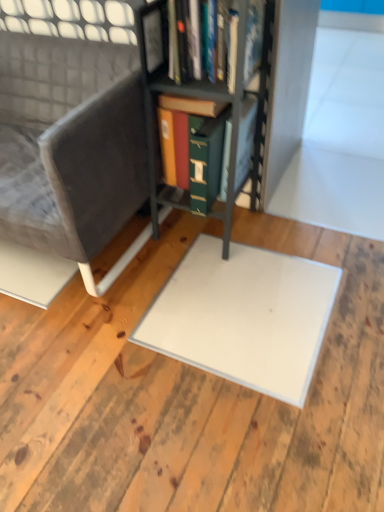
Question: Is metallic gray bookcase at center a part of white matte plywood at center?

Choices:
 (A) yes
 (B) no

Answer: (B)

Question: Is white matte plywood at center at the left side of metallic gray bookcase at center?

Choices:
 (A) no
 (B) yes

Answer: (B)

Question: Does white matte plywood at center have a greater width compared to metallic gray bookcase at center?

Choices:
 (A) no
 (B) yes

Answer: (B)

Question: From the image's perspective, would you say white matte plywood at center is positioned over metallic gray bookcase at center?

Choices:
 (A) no
 (B) yes

Answer: (A)

Question: Can you confirm if white matte plywood at center is shorter than metallic gray bookcase at center?

Choices:
 (A) no
 (B) yes

Answer: (B)

Question: Considering their positions, is velvet grey chair at left located in front of or behind metallic gray bookcase at center?

Choices:
 (A) behind
 (B) front

Answer: (A)

Question: From the image's perspective, is velvet grey chair at left located above or below metallic gray bookcase at center?

Choices:
 (A) below
 (B) above

Answer: (A)

Question: Looking at their shapes, would you say velvet grey chair at left is wider or thinner than metallic gray bookcase at center?

Choices:
 (A) wide
 (B) thin

Answer: (A)

Question: From a real-world perspective, relative to metallic gray bookcase at center, is velvet grey chair at left vertically above or below?

Choices:
 (A) above
 (B) below

Answer: (B)

Question: Is white matte plywood at center to the left or to the right of velvet grey chair at left in the image?

Choices:
 (A) left
 (B) right

Answer: (B)

Question: Considering the positions of white matte plywood at center and velvet grey chair at left in the image, is white matte plywood at center bigger or smaller than velvet grey chair at left?

Choices:
 (A) big
 (B) small

Answer: (B)

Question: Which is correct: white matte plywood at center is inside velvet grey chair at left, or outside of it?

Choices:
 (A) outside
 (B) inside

Answer: (A)

Question: From a real-world perspective, is white matte plywood at center above or below velvet grey chair at left?

Choices:
 (A) below
 (B) above

Answer: (A)

Question: Does point (226, 90) appear closer or farther from the camera than point (29, 386)?

Choices:
 (A) closer
 (B) farther

Answer: (B)

Question: Looking at the image, does metallic gray bookcase at center seem bigger or smaller compared to white matte plywood at center?

Choices:
 (A) big
 (B) small

Answer: (B)